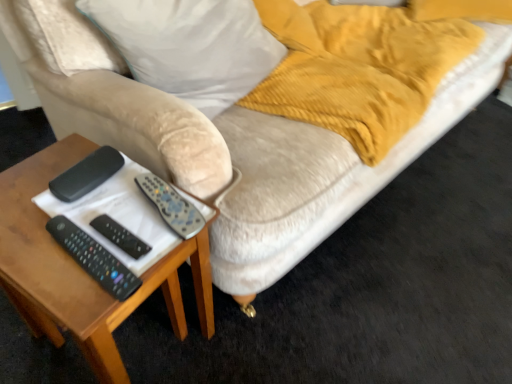
Question: Can you confirm if silver metallic remote at center, the first remote when ordered from top to bottom, is wider than black plastic remote control at left?

Choices:
 (A) yes
 (B) no

Answer: (A)

Question: Can you confirm if silver metallic remote at center, the first remote when ordered from top to bottom, is smaller than black plastic remote control at left?

Choices:
 (A) yes
 (B) no

Answer: (A)

Question: From a real-world perspective, does silver metallic remote at center, the first remote when ordered from top to bottom, sit lower than black plastic remote control at left?

Choices:
 (A) no
 (B) yes

Answer: (B)

Question: Is silver metallic remote at center, the third remote positioned from the bottom, far from black plastic remote control at left?

Choices:
 (A) yes
 (B) no

Answer: (B)

Question: Is silver metallic remote at center, the first remote when ordered from top to bottom, thinner than black plastic remote control at left?

Choices:
 (A) no
 (B) yes

Answer: (A)

Question: From a real-world perspective, is black plastic remote control at left physically located above or below white fabric pillow at upper left?

Choices:
 (A) below
 (B) above

Answer: (A)

Question: Is black plastic remote control at left to the left or to the right of white fabric pillow at upper left in the image?

Choices:
 (A) left
 (B) right

Answer: (A)

Question: Is point (89, 188) closer or farther from the camera than point (202, 72)?

Choices:
 (A) farther
 (B) closer

Answer: (B)

Question: In terms of width, does black plastic remote control at left look wider or thinner when compared to white fabric pillow at upper left?

Choices:
 (A) thin
 (B) wide

Answer: (A)

Question: In terms of width, does black plastic remote at center, positioned as the second remote in top-to-bottom order, look wider or thinner when compared to black plastic remote at lower left, which appears as the third remote when viewed from the top?

Choices:
 (A) wide
 (B) thin

Answer: (B)

Question: Which is correct: black plastic remote at center, arranged as the 2th remote when ordered from the bottom, is inside black plastic remote at lower left, which appears as the third remote when viewed from the top, or outside of it?

Choices:
 (A) inside
 (B) outside

Answer: (B)

Question: From a real-world perspective, is black plastic remote at center, arranged as the 2th remote when ordered from the bottom, above or below black plastic remote at lower left, which appears as the third remote when viewed from the top?

Choices:
 (A) above
 (B) below

Answer: (B)

Question: Is point (101, 221) positioned closer to the camera than point (95, 264)?

Choices:
 (A) closer
 (B) farther

Answer: (B)

Question: From a real-world perspective, is white fabric pillow at upper left physically located above or below wooden table at lower left?

Choices:
 (A) above
 (B) below

Answer: (A)

Question: From the image's perspective, is white fabric pillow at upper left located above or below wooden table at lower left?

Choices:
 (A) below
 (B) above

Answer: (B)